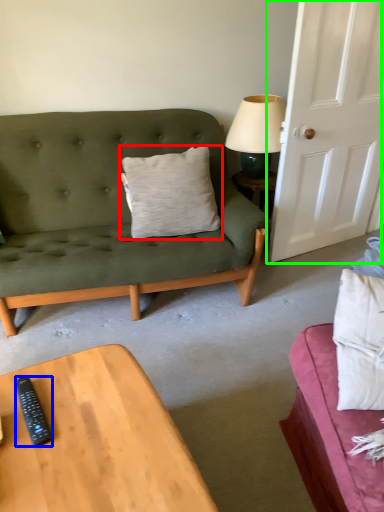
Question: Which object is positioned closest to pillow (highlighted by a red box)? Select from remote control (highlighted by a blue box) and door (highlighted by a green box).

Choices:
 (A) remote control
 (B) door

Answer: (B)